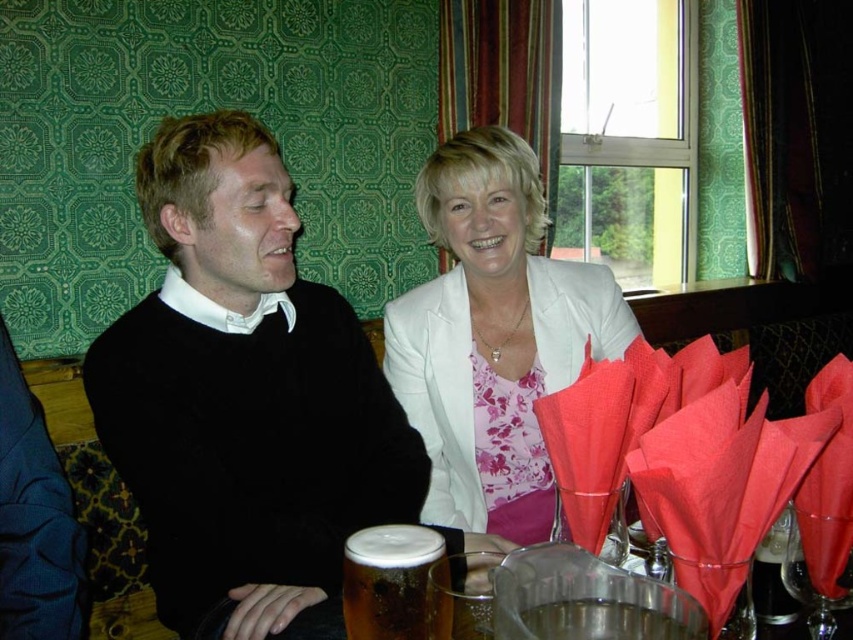
You are standing in the pub and want to place a small plant on the table. The table is at point (502,368). If your arm can reach 5 feet, can you place the plant on the table without moving closer?

The distance of point (502,368) from the viewer is 5.14 feet, so your arm cannot reach it. You need to move closer to place the plant.

You are a server at a restaurant and need to place a new drink order between the foamy amber liquid at lower center and the translucent glass beer at center. Can you fit it there?

The distance between the foamy amber liquid at lower center and the translucent glass beer at center is 5.63 inches, so yes, you can fit a new drink order between them as there is enough space.